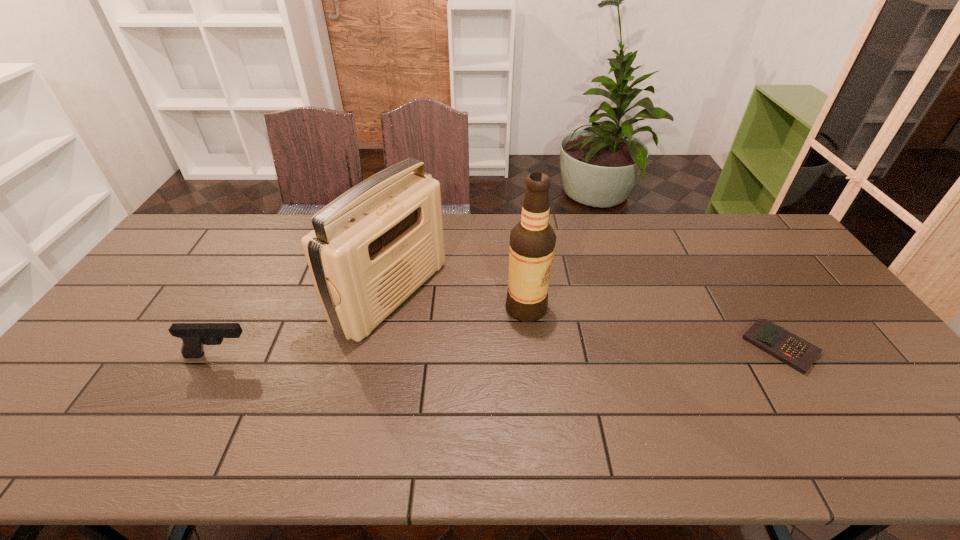
I want to click on vacant spot on the desktop that is between the second shortest object and the calculator and is positioned on the front-facing side of the radio receiver, so click(x=510, y=352).

Where is `vacant spot on the desktop that is between the pistol and the shortest object and is positioned on the label of the third object from left to right`? The width and height of the screenshot is (960, 540). vacant spot on the desktop that is between the pistol and the shortest object and is positioned on the label of the third object from left to right is located at coordinates (579, 350).